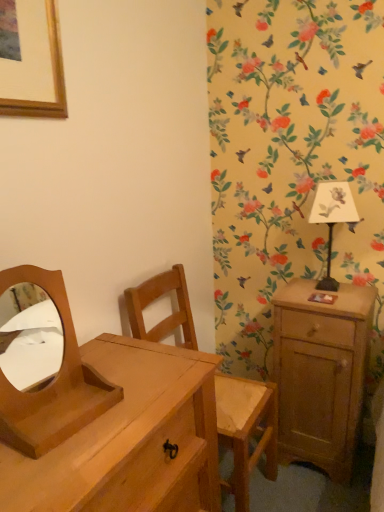
Identify the location of free space in front of white paper lampshade at upper right. (337, 303).